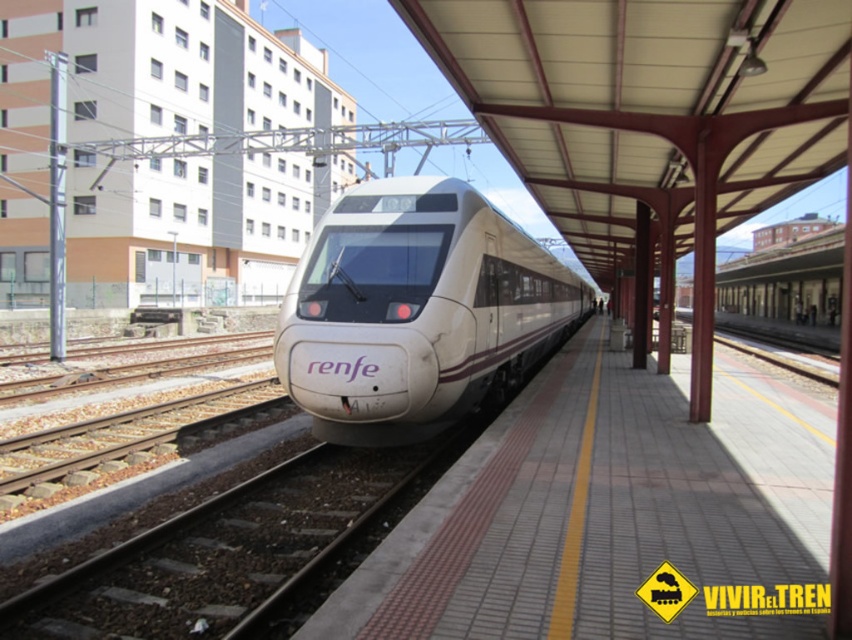
Does white tile platform at center have a lesser width compared to white glossy bullet train at center?

Yes.

Who is taller, white tile platform at center or white glossy bullet train at center?

white glossy bullet train at center

In order to click on white tile platform at center in this screenshot , I will do `click(605, 513)`.